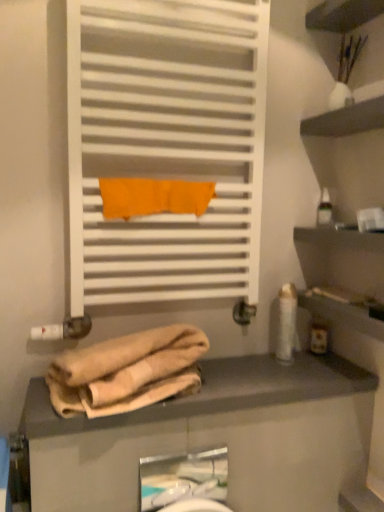
The height and width of the screenshot is (512, 384). I want to click on free space in front of translucent plastic bottle at right, which ranks as the second toiletry in right-to-left order, so click(x=321, y=370).